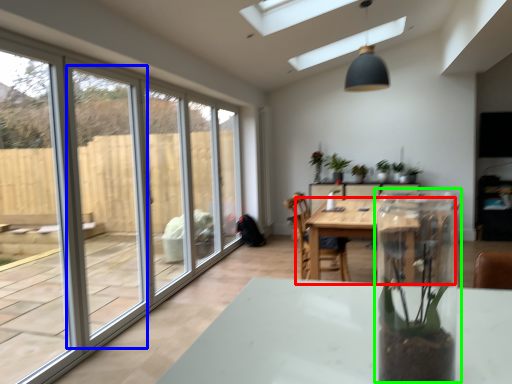
Question: Estimate the real-world distances between objects in this image. Which object is farther from table (highlighted by a red box), screen door (highlighted by a blue box) or glass box (highlighted by a green box)?

Choices:
 (A) screen door
 (B) glass box

Answer: (A)